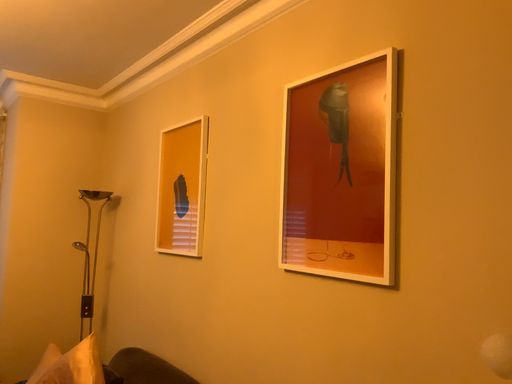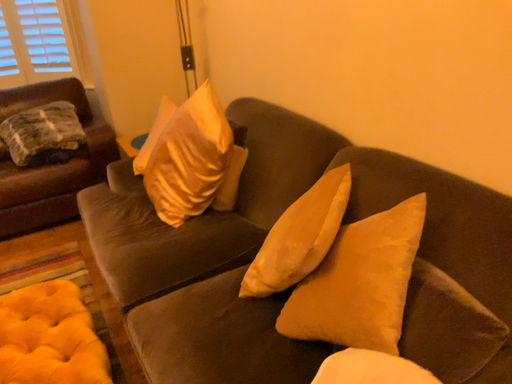
Question: How did the camera likely rotate when shooting the video?

Choices:
 (A) rotated right
 (B) rotated left

Answer: (B)